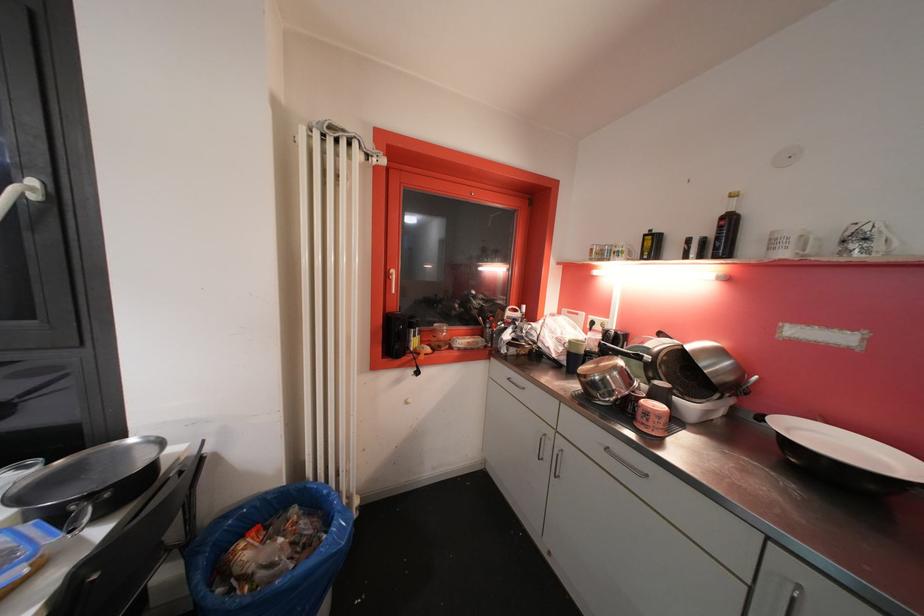
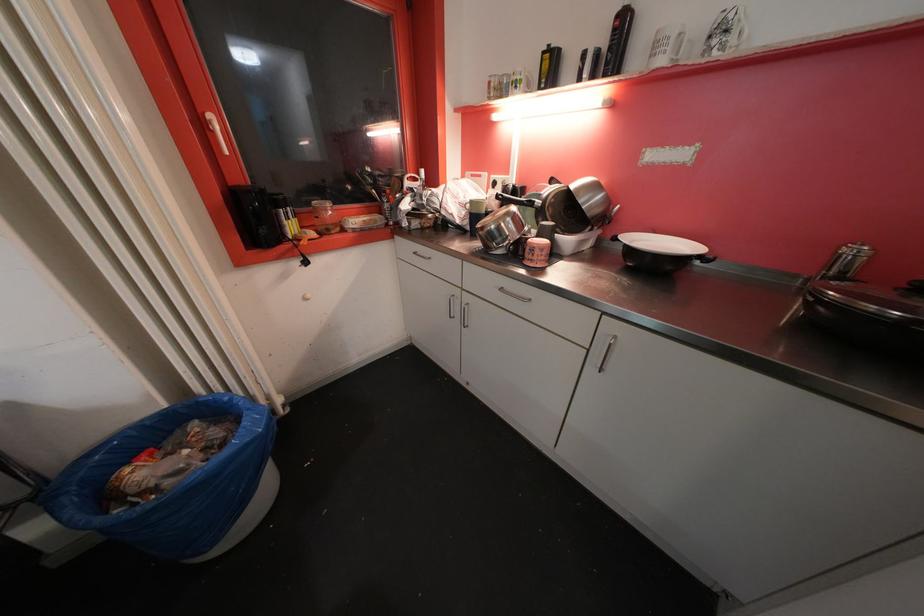
In the second image, find the point that corresponds to the point at 735,224 in the first image.

(628, 25)